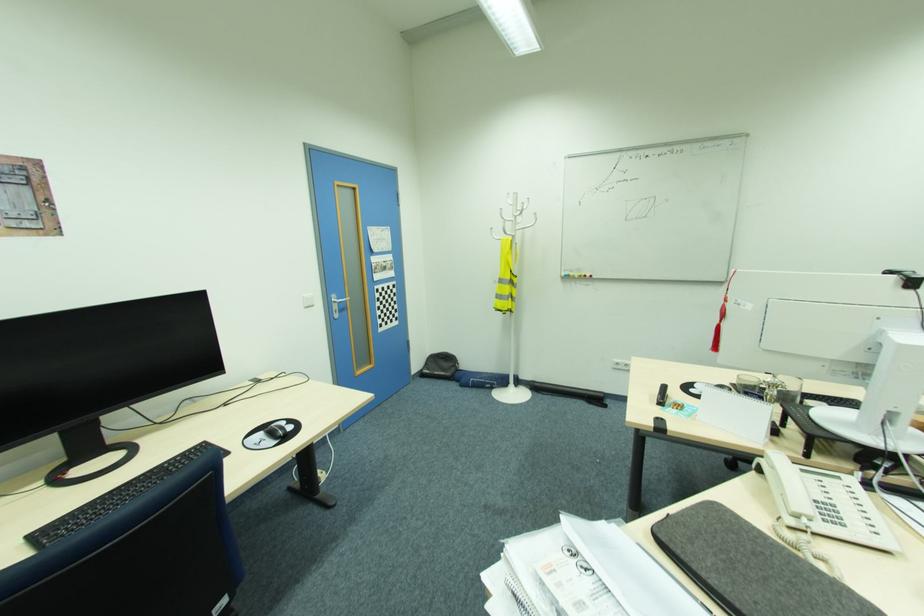
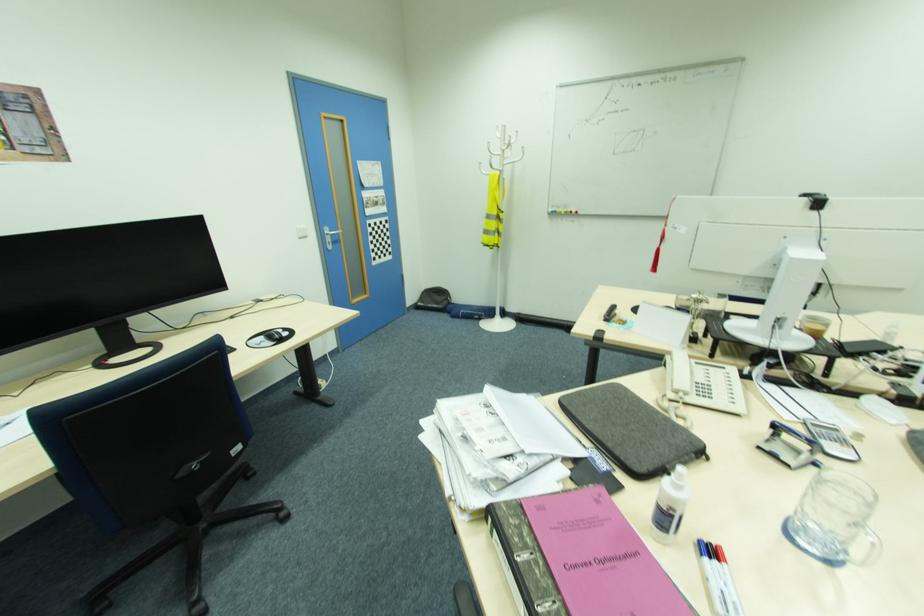
The images are taken continuously from a first-person perspective. In which direction are you moving?

The cameraman moved toward right, backward.